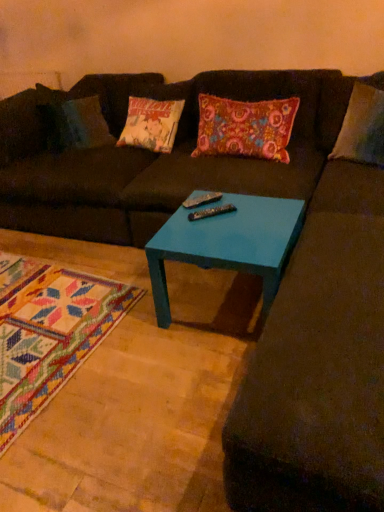
The image size is (384, 512). What are the coordinates of `vacant point to the right of black plastic remote at center, the second remote when ordered from back to front` in the screenshot? It's located at point(244,213).